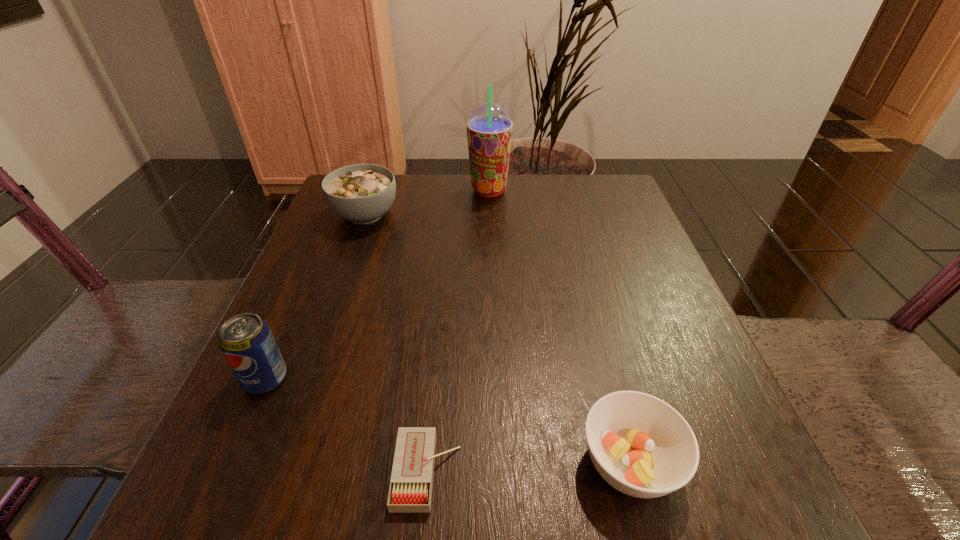
Identify the location of free spot located 0.260m on the front of the left soup bowl. The width and height of the screenshot is (960, 540). (327, 320).

Identify the location of free space located on the left of the fourth tallest object. The image size is (960, 540). (488, 463).

You are a GUI agent. You are given a task and a screenshot of the screen. Output one action in this format:
    pyautogui.click(x=<x>, y=<y>)
    Task: Click on the free space located 0.230m on the striking surface of the matchbox
    
    Given the screenshot: What is the action you would take?
    pyautogui.click(x=636, y=471)

Locate an element on the screen. smoothie positioned at the far edge is located at coordinates (489, 127).

The height and width of the screenshot is (540, 960). I want to click on soup bowl located in the far edge section of the desktop, so click(361, 193).

Where is `soup bowl at the near edge`? soup bowl at the near edge is located at coordinates (640, 445).

Identify the location of matchbox that is at the near edge. (410, 491).

Locate an element on the screen. soda that is at the left edge is located at coordinates pyautogui.click(x=246, y=340).

Locate an element on the screen. soup bowl situated at the left edge is located at coordinates (361, 193).

Locate an element on the screen. This screenshot has height=540, width=960. object located at the right edge is located at coordinates (640, 445).